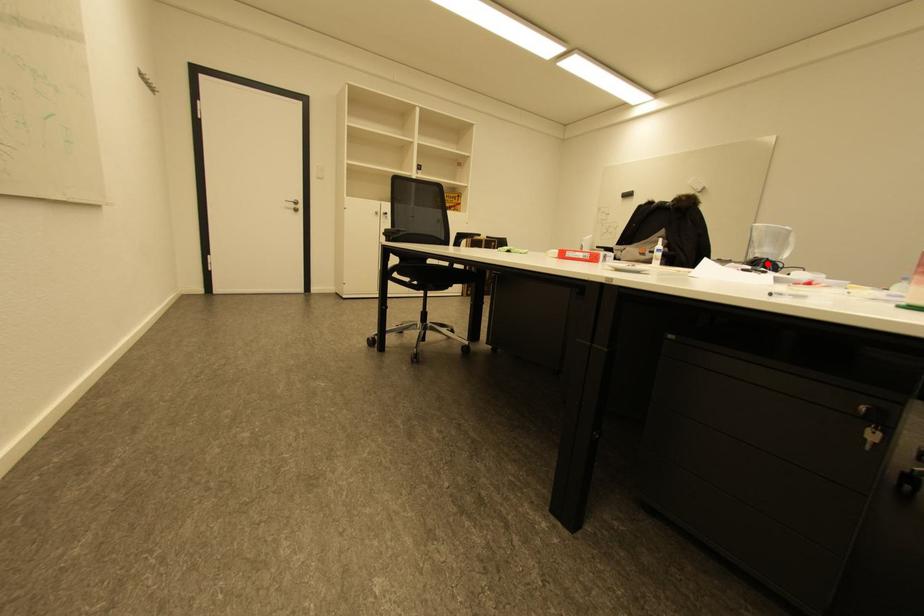
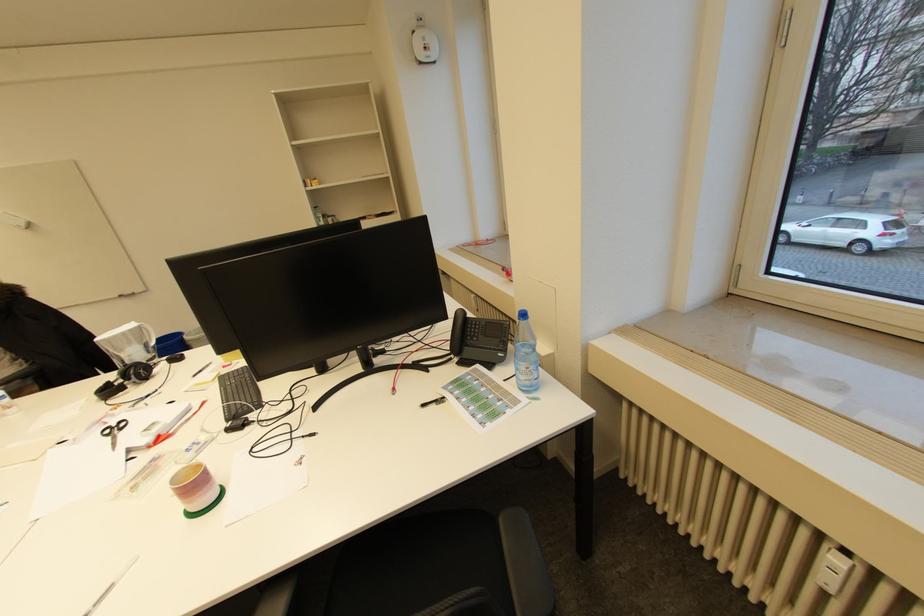
In the second image, find the point that corresponds to the highlighted location in the first image.

(140, 377)